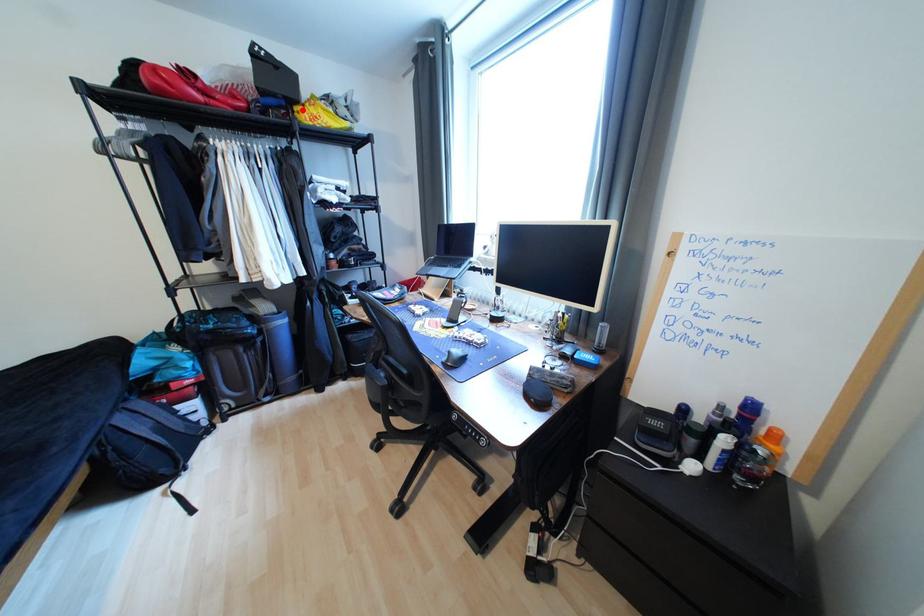
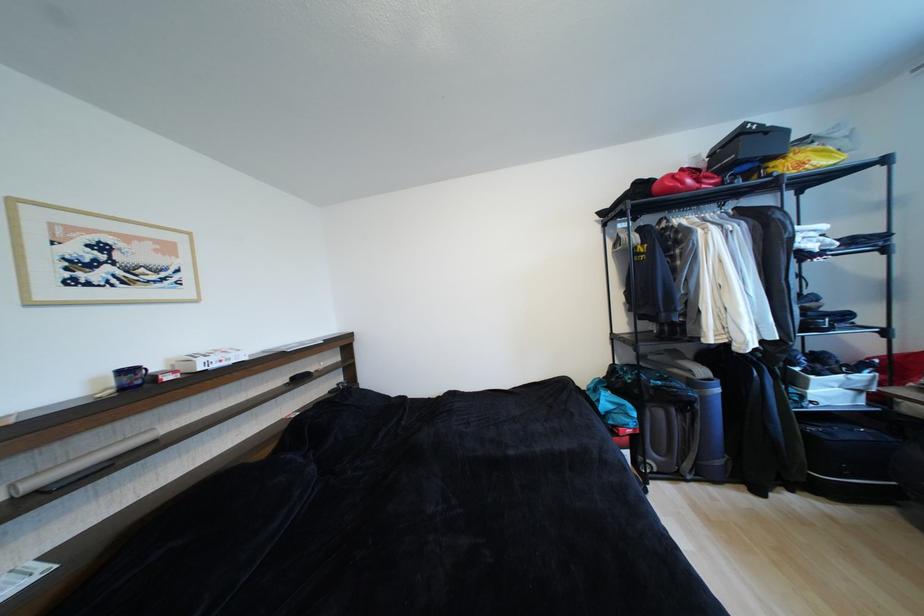
The point at the highlighted location is marked in the first image. Where is the corresponding point in the second image?

(780, 166)